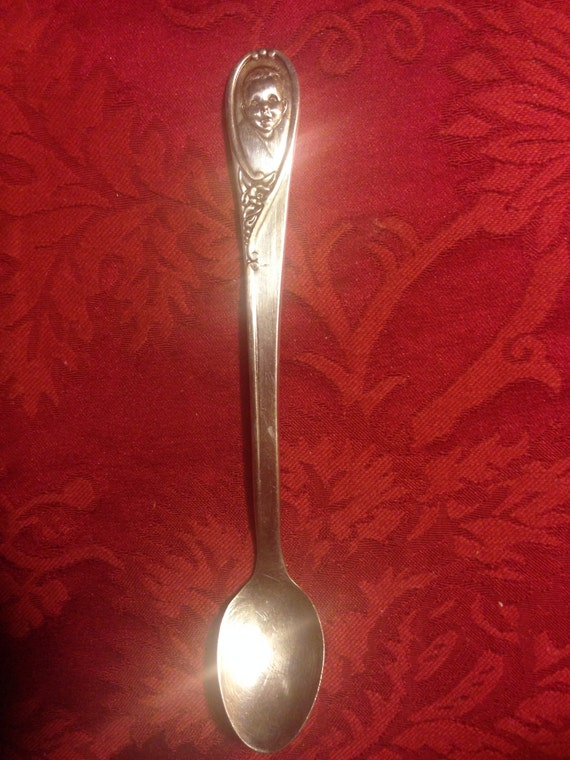
Identify the location of silver spoon. The width and height of the screenshot is (570, 760). (268, 391).